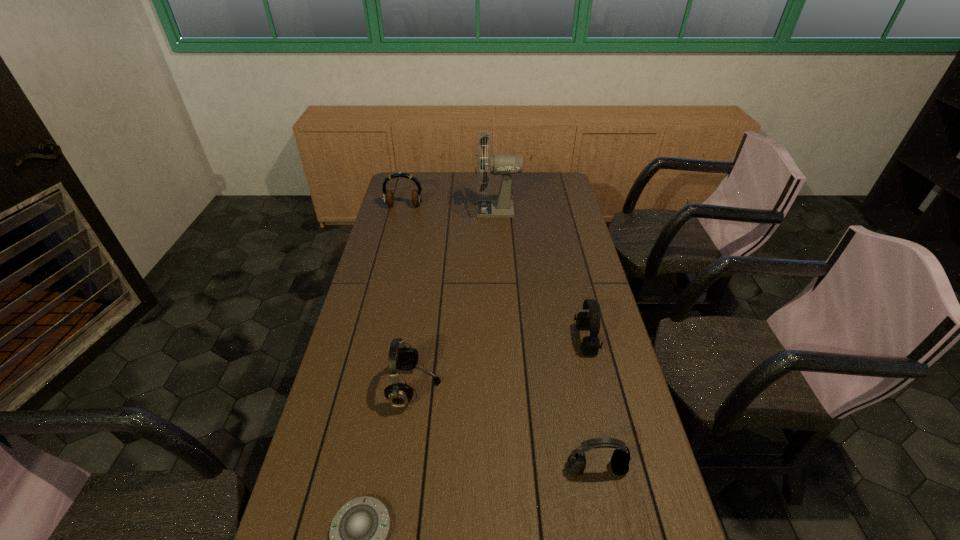
Locate an element on the screen. Image resolution: width=960 pixels, height=540 pixels. the tallest object is located at coordinates (505, 165).

Where is `the fourth object from left to right`? This screenshot has height=540, width=960. the fourth object from left to right is located at coordinates (505, 165).

Locate an element on the screen. This screenshot has height=540, width=960. the second nearest headset is located at coordinates (401, 357).

What are the coordinates of `the farthest headset` in the screenshot? It's located at (388, 197).

I want to click on the second farthest headset, so click(x=590, y=345).

The width and height of the screenshot is (960, 540). In order to click on the shortest headset in this screenshot , I will do pyautogui.click(x=620, y=459).

Image resolution: width=960 pixels, height=540 pixels. I want to click on the fifth farthest object, so click(x=620, y=459).

Image resolution: width=960 pixels, height=540 pixels. Identify the location of free spot located 0.250m on the air flow direction of the fourth object from left to right. (420, 210).

Find the location of a particular element. vacant space located 0.100m on the air flow direction of the fourth object from left to right is located at coordinates (453, 210).

Find the location of a particular element. This screenshot has height=540, width=960. free point located on the air flow direction of the fourth object from left to right is located at coordinates (388, 210).